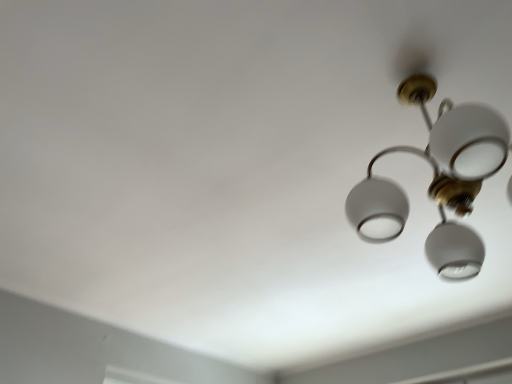
You are a GUI agent. You are given a task and a screenshot of the screen. Output one action in this format:
    pyautogui.click(x=<x>, y=<y>)
    Task: Click on the white frosted glass chandelier at upper right
    The height and width of the screenshot is (384, 512).
    Given the screenshot: What is the action you would take?
    pyautogui.click(x=437, y=180)

The width and height of the screenshot is (512, 384). Describe the element at coordinates (437, 180) in the screenshot. I see `white frosted glass chandelier at upper right` at that location.

Identify the location of white frosted glass chandelier at upper right. This screenshot has width=512, height=384. point(437,180).